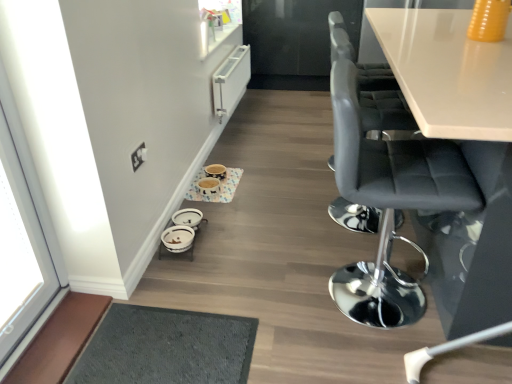
Question: Is gray fabric chair at right, the 1th chair when ordered from back to front, at the right side of white glass window at left?

Choices:
 (A) yes
 (B) no

Answer: (A)

Question: Is gray fabric chair at right, the 1th chair when ordered from back to front, at the left side of white glass window at left?

Choices:
 (A) yes
 (B) no

Answer: (B)

Question: Does gray fabric chair at right, the 2th chair viewed from the front, have a lesser width compared to white glass window at left?

Choices:
 (A) no
 (B) yes

Answer: (A)

Question: Can we say gray fabric chair at right, the 1th chair when ordered from back to front, lies outside white glass window at left?

Choices:
 (A) no
 (B) yes

Answer: (B)

Question: Does gray fabric chair at right, the 2th chair viewed from the front, have a larger size compared to white glass window at left?

Choices:
 (A) yes
 (B) no

Answer: (A)

Question: Is white ceramic bowls at lower center, acting as the first round table starting from the front, in front of or behind matte ceramic bowls at center, the second round table in the front-to-back sequence, in the image?

Choices:
 (A) behind
 (B) front

Answer: (B)

Question: Visually, is white ceramic bowls at lower center, which appears as the second round table when viewed from the top, positioned to the left or to the right of matte ceramic bowls at center, the second round table in the front-to-back sequence?

Choices:
 (A) right
 (B) left

Answer: (B)

Question: In terms of width, does white ceramic bowls at lower center, the first round table when ordered from bottom to top, look wider or thinner when compared to matte ceramic bowls at center, which is the second round table from bottom to top?

Choices:
 (A) thin
 (B) wide

Answer: (A)

Question: Considering the positions of point (189, 258) and point (187, 192), is point (189, 258) closer or farther from the camera than point (187, 192)?

Choices:
 (A) farther
 (B) closer

Answer: (B)

Question: In terms of size, does white ceramic bowls at lower center, acting as the first round table starting from the front, appear bigger or smaller than white glass window at left?

Choices:
 (A) big
 (B) small

Answer: (B)

Question: Considering the positions of white ceramic bowls at lower center, which is the 2th round table in back-to-front order, and white glass window at left in the image, is white ceramic bowls at lower center, which is the 2th round table in back-to-front order, taller or shorter than white glass window at left?

Choices:
 (A) short
 (B) tall

Answer: (A)

Question: Is point (183, 243) positioned closer to the camera than point (36, 240)?

Choices:
 (A) closer
 (B) farther

Answer: (B)

Question: Looking at their shapes, would you say white ceramic bowls at lower center, which is the 2th round table in back-to-front order, is wider or thinner than white glass window at left?

Choices:
 (A) wide
 (B) thin

Answer: (A)

Question: Considering the positions of point (352, 97) and point (14, 178), is point (352, 97) closer or farther from the camera than point (14, 178)?

Choices:
 (A) farther
 (B) closer

Answer: (B)

Question: Is black leather stool at right, the second chair positioned from the back, bigger or smaller than white glass window at left?

Choices:
 (A) small
 (B) big

Answer: (B)